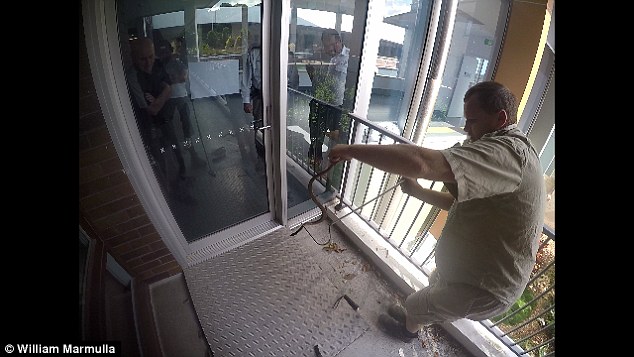
This screenshot has height=357, width=634. I want to click on the top of railing, so click(x=359, y=119).